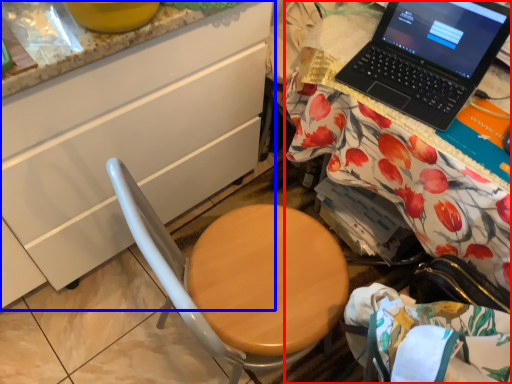
Question: Which of the following is the farthest to the observer, desk (highlighted by a red box) or cabinetry (highlighted by a blue box)?

Choices:
 (A) desk
 (B) cabinetry

Answer: (A)